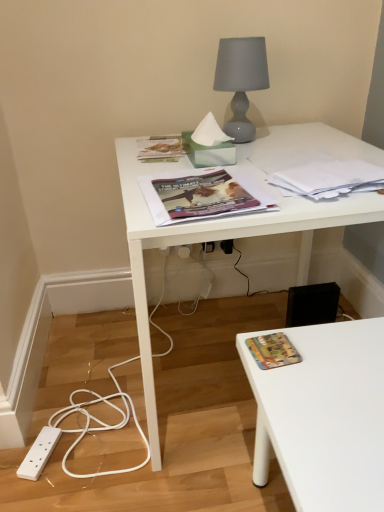
The image size is (384, 512). Identify the location of empty space that is ontop of matte green paperback book at upper center, acting as the second paperback book starting from the bottom (from a real-world perspective). (162, 143).